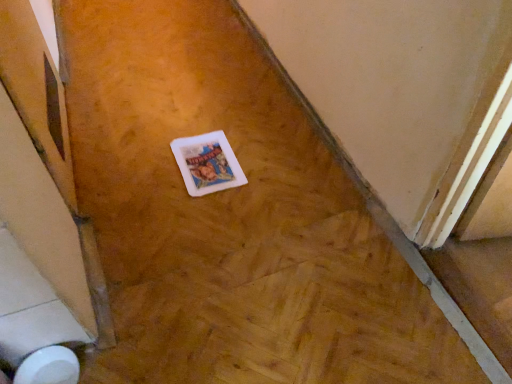
This screenshot has height=384, width=512. Identify the location of free space above white glossy postcard at center (from a real-world perspective). (204, 161).